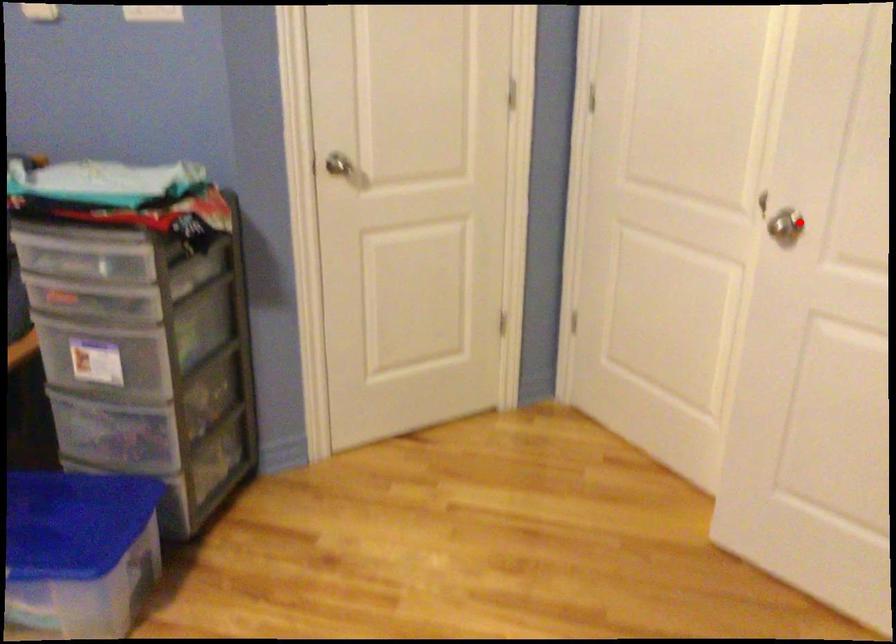
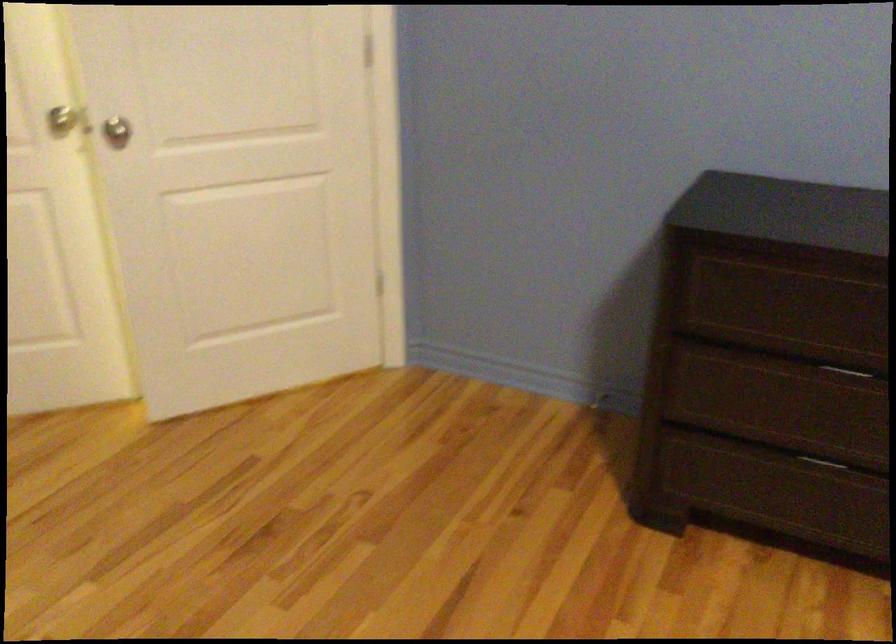
Question: I am providing you with two images of the same scene from different viewpoints. In image1, a red point is highlighted. Considering the same 3D point in image2, which of the following is correct?

Choices:
 (A) It is closer
 (B) It is farther

Answer: (B)